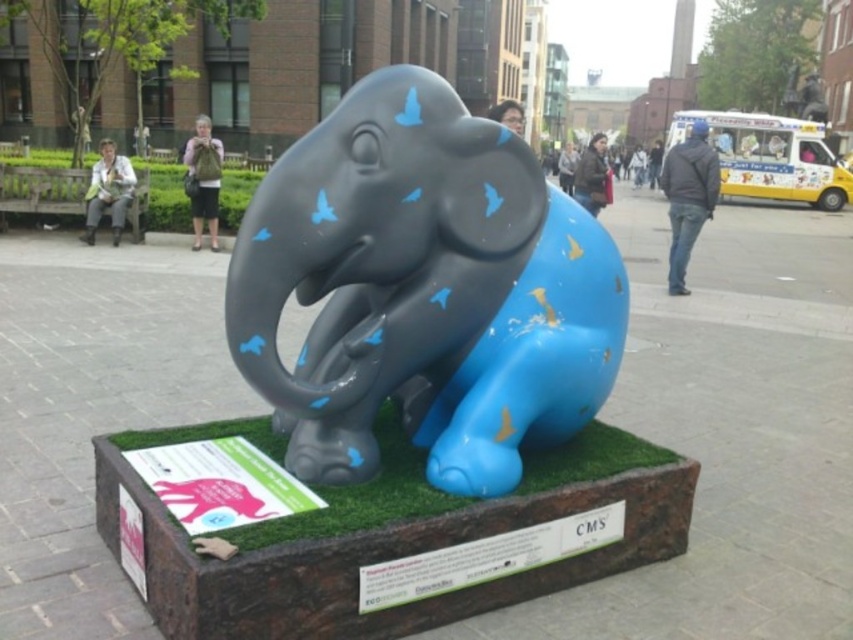
Is point (434, 444) farther from camera compared to point (408, 493)?

Yes, point (434, 444) is behind point (408, 493).

The height and width of the screenshot is (640, 853). What do you see at coordinates (532, 358) in the screenshot?
I see `blue matte elephant at center` at bounding box center [532, 358].

Find the location of a particular element. The width and height of the screenshot is (853, 640). blue matte elephant at center is located at coordinates (532, 358).

Which is more to the left, matte black elephant at center or green artificial turf at center?

Positioned to the left is green artificial turf at center.

What do you see at coordinates (422, 291) in the screenshot? I see `matte black elephant at center` at bounding box center [422, 291].

Where is `matte black elephant at center`? Image resolution: width=853 pixels, height=640 pixels. matte black elephant at center is located at coordinates (422, 291).

Does matte black elephant at center have a lesser height compared to blue matte elephant at center?

No, matte black elephant at center is not shorter than blue matte elephant at center.

Which is behind, point (404, 285) or point (520, 291)?

Positioned behind is point (520, 291).

Does point (440, 308) come closer to viewer compared to point (544, 419)?

Yes.

Locate an element on the screen. Image resolution: width=853 pixels, height=640 pixels. matte black elephant at center is located at coordinates (422, 291).